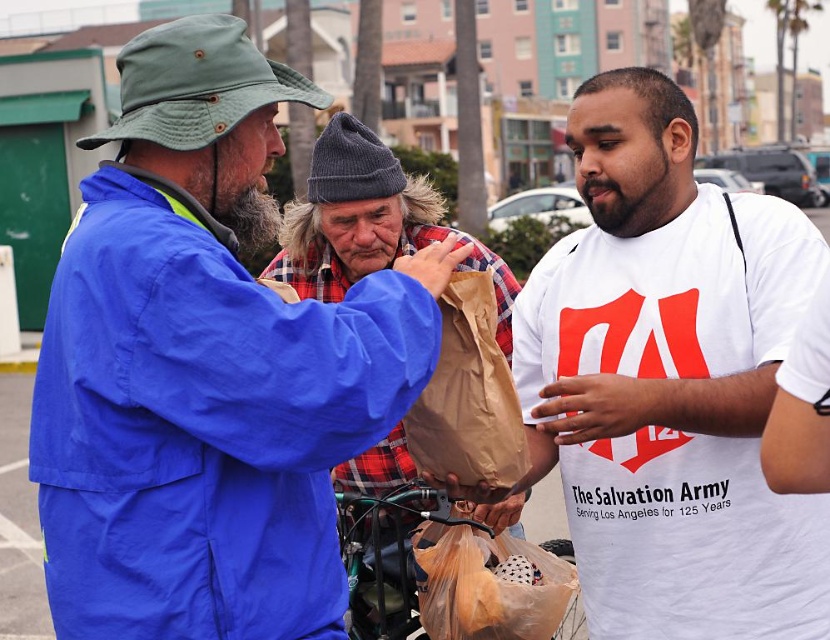
Question: Can you confirm if white cotton t-shirt at center is positioned to the right of plaid fabric shirt at center?

Choices:
 (A) yes
 (B) no

Answer: (A)

Question: Does white cotton t-shirt at center lie in front of translucent plastic bag at center?

Choices:
 (A) yes
 (B) no

Answer: (A)

Question: Among these points, which one is farthest from the camera?

Choices:
 (A) (408, 422)
 (B) (696, 364)

Answer: (A)

Question: Is white cotton t-shirt at center above brown paper bag at center?

Choices:
 (A) no
 (B) yes

Answer: (B)

Question: Which object is positioned closest to the blue fabric jacket at upper left?

Choices:
 (A) plaid fabric shirt at center
 (B) white cotton t-shirt at center

Answer: (B)

Question: Which of these objects is positioned closest to the plaid fabric shirt at center?

Choices:
 (A) brown paper bag at center
 (B) blue fabric jacket at upper left
 (C) white cotton t-shirt at center
 (D) translucent plastic bag at center

Answer: (D)